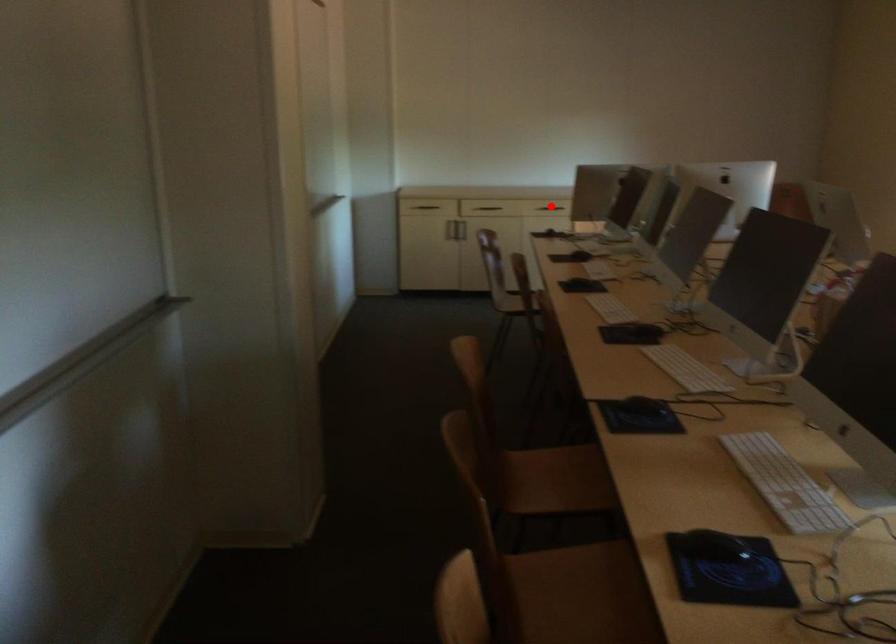
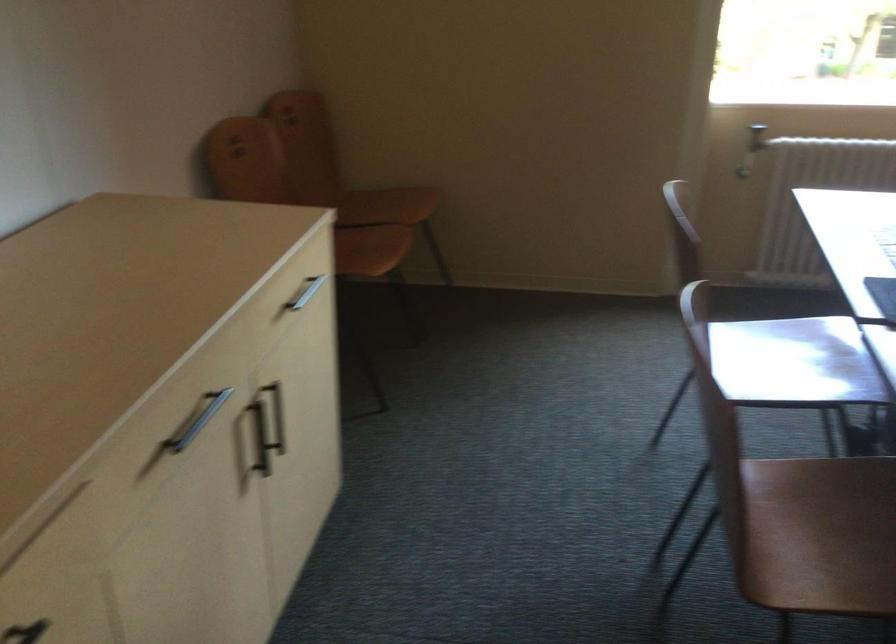
Question: I am providing you with two images of the same scene from different viewpoints. A red point is marked on the first image. Can you still see the location of the red point in image 2?

Choices:
 (A) Yes
 (B) No

Answer: (B)